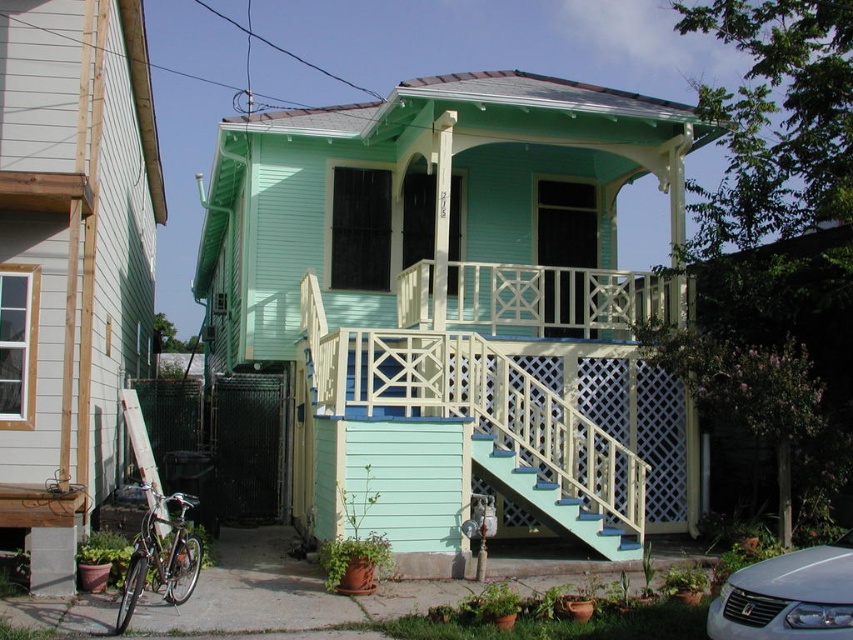
Question: Where is satin silver sedan at lower right located in relation to teal painted wood stairs at center in the image?

Choices:
 (A) below
 (B) above

Answer: (B)

Question: Does light blue wood stairs at center have a smaller size compared to teal painted wood stairs at center?

Choices:
 (A) yes
 (B) no

Answer: (B)

Question: Among these points, which one is farthest from the camera?

Choices:
 (A) (810, 616)
 (B) (508, 468)

Answer: (B)

Question: Does light blue wood stairs at center appear on the right side of satin silver sedan at lower right?

Choices:
 (A) yes
 (B) no

Answer: (B)

Question: Among these objects, which one is farthest from the camera?

Choices:
 (A) light blue wood stairs at center
 (B) teal painted wood stairs at center
 (C) satin silver sedan at lower right

Answer: (B)

Question: Which object is farther from the camera taking this photo?

Choices:
 (A) satin silver sedan at lower right
 (B) light blue wood stairs at center
 (C) teal painted wood stairs at center

Answer: (C)